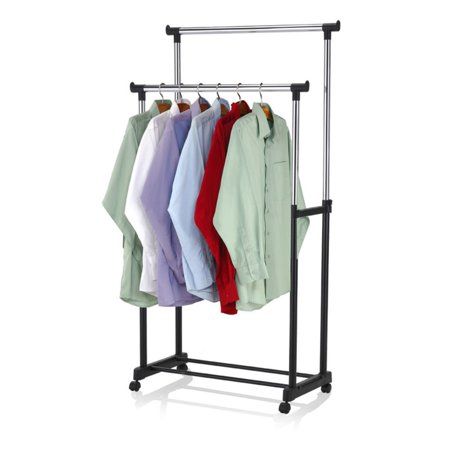
Locate an element on the screen. The height and width of the screenshot is (450, 450). metal garment rack legs is located at coordinates (143, 331), (178, 329), (293, 346), (325, 340).